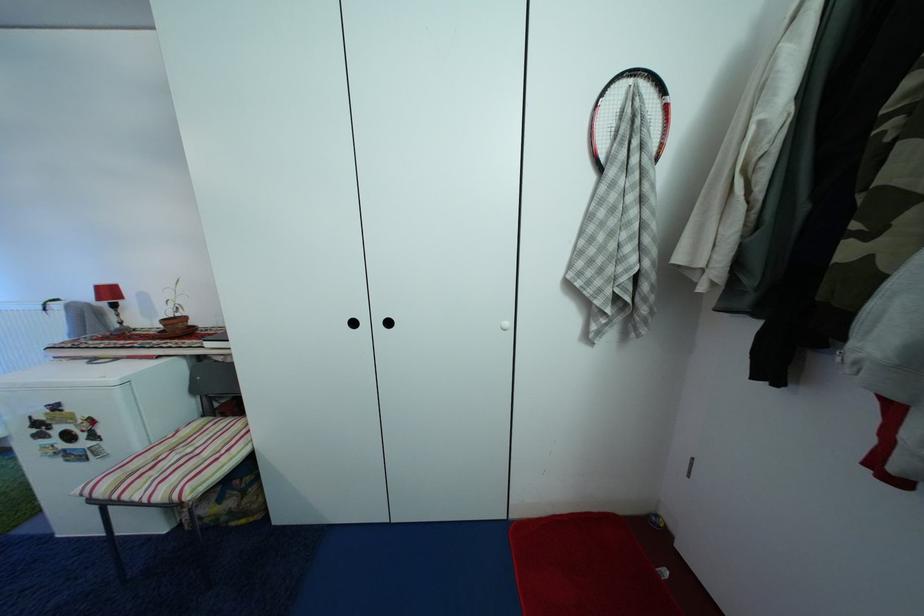
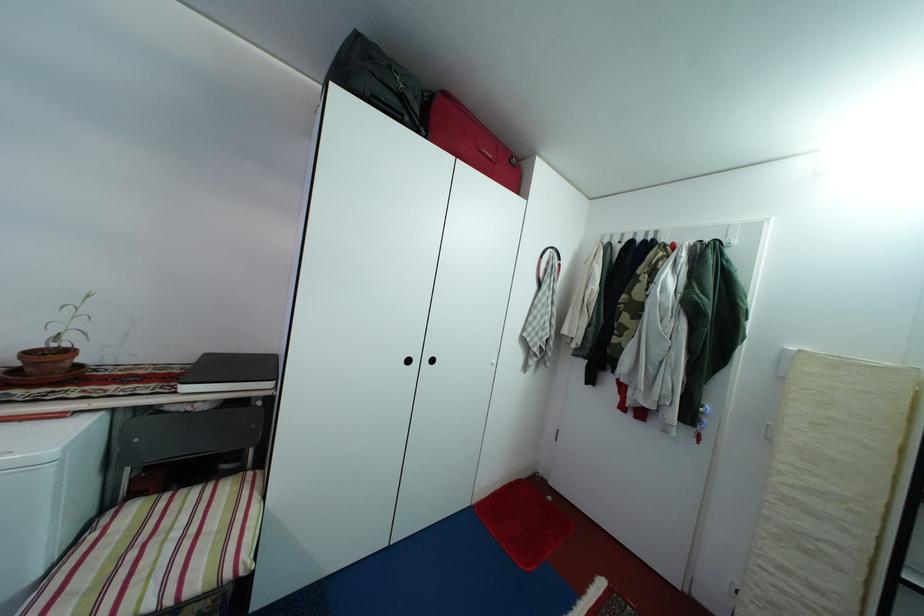
In the second image, find the point that corresponds to [174,326] in the first image.

(38, 361)